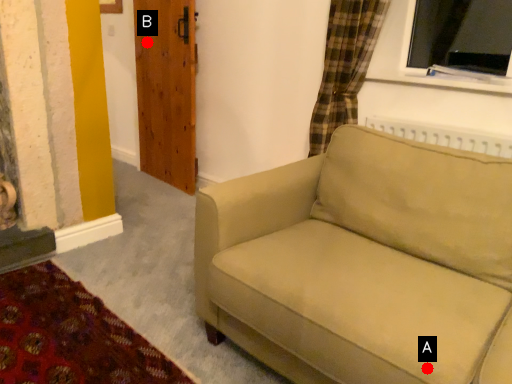
Question: Two points are circled on the image, labeled by A and B beside each circle. Among these points, which one is farthest from the camera?

Choices:
 (A) A is further
 (B) B is further

Answer: (B)